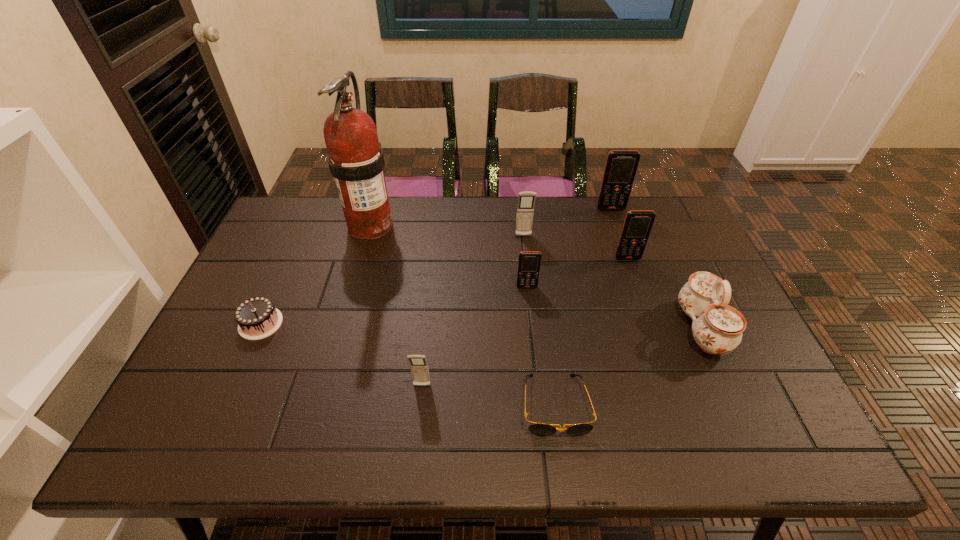
The height and width of the screenshot is (540, 960). In order to click on vacant space located on the front-facing side of the second farthest cellular telephone in this screenshot , I will do `click(530, 295)`.

You are a GUI agent. You are given a task and a screenshot of the screen. Output one action in this format:
    pyautogui.click(x=<x>, y=<y>)
    Task: Click on the free region located 0.130m on the screen of the fourth farthest object
    
    Given the screenshot: What is the action you would take?
    pyautogui.click(x=639, y=292)

Locate an element on the screen. The height and width of the screenshot is (540, 960). free point located 0.260m by the handle of the rightmost object is located at coordinates (582, 328).

Locate an element on the screen. vacant space located 0.390m by the handle of the rightmost object is located at coordinates (533, 328).

Locate an element on the screen. vacant space located 0.120m by the handle of the rightmost object is located at coordinates (635, 328).

Locate an element on the screen. free space located 0.070m on the screen of the smallest orange cellular telephone is located at coordinates (529, 307).

The image size is (960, 540). What are the coordinates of `free space located on the front-facing side of the leftmost cellular telephone` in the screenshot? It's located at (420, 409).

Image resolution: width=960 pixels, height=540 pixels. I want to click on blank space located on the front of the second shortest object, so click(x=233, y=384).

Find the location of a particular element. fire extinguisher situated at the far edge is located at coordinates (356, 161).

I want to click on object that is at the near edge, so click(542, 429).